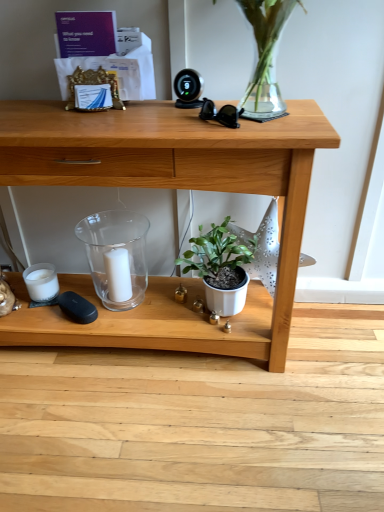
Question: Is transparent glass candle holder at center closer to the viewer compared to white matte candle at center?

Choices:
 (A) no
 (B) yes

Answer: (B)

Question: From a real-world perspective, does transparent glass candle holder at center stand above white matte candle at center?

Choices:
 (A) no
 (B) yes

Answer: (B)

Question: Is transparent glass candle holder at center placed right next to white matte candle at center?

Choices:
 (A) yes
 (B) no

Answer: (A)

Question: Does transparent glass candle holder at center turn towards white matte candle at center?

Choices:
 (A) yes
 (B) no

Answer: (A)

Question: Is transparent glass candle holder at center not near white matte candle at center?

Choices:
 (A) yes
 (B) no

Answer: (B)

Question: Can you confirm if transparent glass candle holder at center is bigger than white matte candle at center?

Choices:
 (A) yes
 (B) no

Answer: (A)

Question: Considering the relative sizes of wooden desk at center and transparent glass candle holder at center in the image provided, is wooden desk at center shorter than transparent glass candle holder at center?

Choices:
 (A) no
 (B) yes

Answer: (A)

Question: Does wooden desk at center touch transparent glass candle holder at center?

Choices:
 (A) no
 (B) yes

Answer: (A)

Question: Is wooden desk at center not within transparent glass candle holder at center?

Choices:
 (A) yes
 (B) no

Answer: (A)

Question: Is wooden desk at center to the left of transparent glass candle holder at center from the viewer's perspective?

Choices:
 (A) yes
 (B) no

Answer: (B)

Question: Would you say wooden desk at center contains transparent glass candle holder at center?

Choices:
 (A) no
 (B) yes

Answer: (B)

Question: From a real-world perspective, is wooden desk at center on transparent glass candle holder at center?

Choices:
 (A) yes
 (B) no

Answer: (A)

Question: Does transparent glass candle holder at center contain wooden desk at center?

Choices:
 (A) yes
 (B) no

Answer: (B)